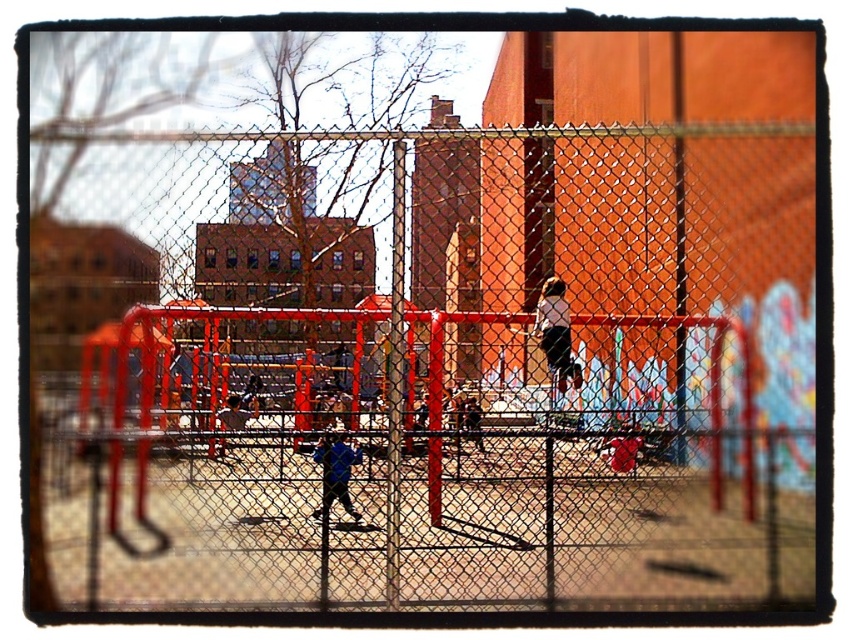
Question: Can you confirm if white matte shirt at upper center is positioned above blue fabric jacket at center?

Choices:
 (A) yes
 (B) no

Answer: (A)

Question: Which of the following is the farthest from the observer?

Choices:
 (A) (738, 365)
 (B) (312, 515)
 (C) (577, 369)

Answer: (C)

Question: Does white matte shirt at upper center have a greater width compared to blue fabric jacket at center?

Choices:
 (A) yes
 (B) no

Answer: (A)

Question: Which of these objects is positioned closest to the metal mesh fence at center?

Choices:
 (A) white matte shirt at upper center
 (B) blue fabric jacket at center

Answer: (B)

Question: Which of the following is the farthest from the observer?

Choices:
 (A) white matte shirt at upper center
 (B) blue fabric jacket at center

Answer: (A)

Question: Can you confirm if metal mesh fence at center is positioned to the left of white matte shirt at upper center?

Choices:
 (A) no
 (B) yes

Answer: (B)